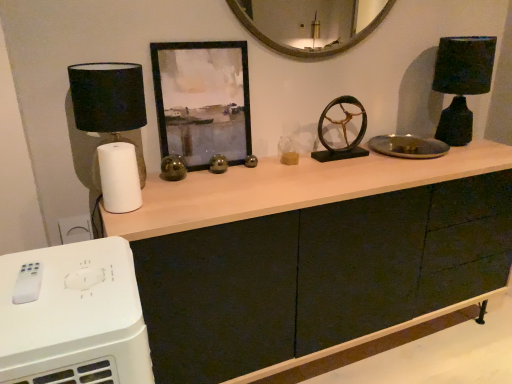
Find the location of a particular element. The image size is (512, 384). vacant space in front of black matte picture frame at center is located at coordinates (208, 185).